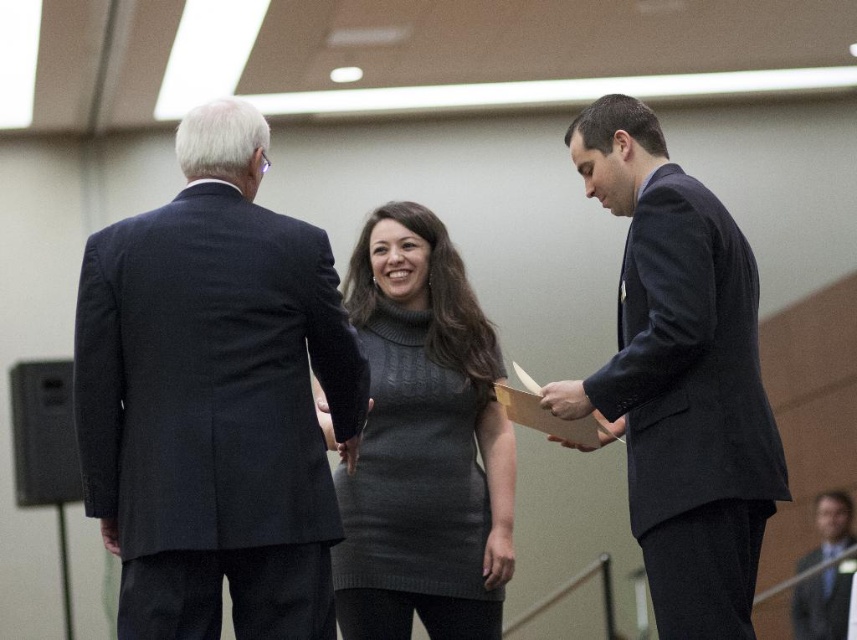
You are standing in the conference room and need to move from the point at coordinates point (364, 452) to the point at coordinates point (814, 596). Which direction should you move to get closer to your destination?

To move from point (364, 452) to point (814, 596), you should move towards the upper right direction since point (814, 596) is located at a higher coordinate in both the x and y axes compared to point (364, 452).

You are an event planner arranging seating for a formal dinner. You need to seat guests according to their positions in the hierarchy. The guest wearing the dark blue suit at left and the guest wearing the dark blue suit at right are both attending. Based on their positions in the image, which guest should be seated closer to the head of the table?

The dark blue suit at left should be seated closer to the head of the table because they are positioned under the dark blue suit at right in the image, indicating a higher rank.